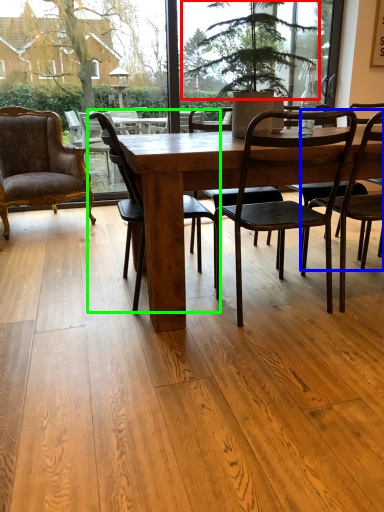
Question: Based on their relative distances, which object is nearer to tree (highlighted by a red box)? Choose from chair (highlighted by a blue box) and chair (highlighted by a green box).

Choices:
 (A) chair
 (B) chair

Answer: (A)